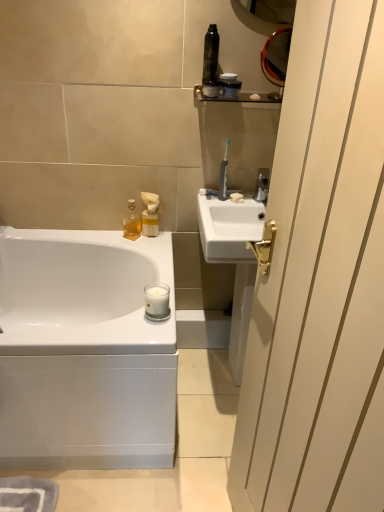
This screenshot has height=512, width=384. What are the coordinates of `white glossy bathtub at lower left` in the screenshot? It's located at (84, 351).

Find the location of `white glossy screen door at right`. white glossy screen door at right is located at coordinates (321, 280).

What's the angular difference between white glossy screen door at right and white glossy bathtub at lower left's facing directions?

They differ by 78.9 degrees in their facing directions.

Which object is further away from the camera, white glossy screen door at right or white glossy bathtub at lower left?

white glossy bathtub at lower left.

Is white glossy screen door at right surrounding white glossy bathtub at lower left?

No, white glossy bathtub at lower left is not surrounded by white glossy screen door at right.

In the scene shown: From a real-world perspective, is white glossy bathtub at lower left located beneath satin black container at upper center, which appears as the 2th toiletry when viewed from the front?

Yes, from a real-world perspective, white glossy bathtub at lower left is under satin black container at upper center, which appears as the 2th toiletry when viewed from the front.

Consider the image. Is white glossy bathtub at lower left in front of or behind satin black container at upper center, the 1th toiletry in the right-to-left sequence, in the image?

Visually, white glossy bathtub at lower left is located in front of satin black container at upper center, the 1th toiletry in the right-to-left sequence.

How distant is white glossy bathtub at lower left from satin black container at upper center, positioned as the 2th toiletry in back-to-front order?

white glossy bathtub at lower left is 1.05 meters away from satin black container at upper center, positioned as the 2th toiletry in back-to-front order.

From the image's perspective, which one is positioned higher, white glossy bathtub at lower left or satin black container at upper center, positioned as the second toiletry in bottom-to-top order?

satin black container at upper center, positioned as the second toiletry in bottom-to-top order, from the image's perspective.

Is white glossy screen door at right far from translucent glass bottle at upper left, positioned as the third toiletry in top-to-bottom order?

That's right, there is a large distance between white glossy screen door at right and translucent glass bottle at upper left, positioned as the third toiletry in top-to-bottom order.

From a real-world perspective, which is physically above, white glossy screen door at right or translucent glass bottle at upper left, marked as the 1th toiletry in a back-to-front arrangement?

white glossy screen door at right, from a real-world perspective.

The width and height of the screenshot is (384, 512). In order to click on screen door above the translucent glass bottle at upper left, which appears as the 1th toiletry when ordered from the bottom (from a real-world perspective) in this screenshot , I will do `click(321, 280)`.

Is white glossy screen door at right surrounding translucent glass bottle at upper left, which is the third toiletry from right to left?

No, white glossy screen door at right does not contain translucent glass bottle at upper left, which is the third toiletry from right to left.

Is the surface of translucent glass bottle at upper left, which is the third toiletry from right to left, in direct contact with shiny black canister at upper center, which is counted as the 2th toiletry, starting from the right?

translucent glass bottle at upper left, which is the third toiletry from right to left, and shiny black canister at upper center, which is counted as the 2th toiletry, starting from the right, are not in contact.

Which object is positioned more to the right, translucent glass bottle at upper left, arranged as the first toiletry when viewed from the left, or shiny black canister at upper center, the third toiletry from the back?

shiny black canister at upper center, the third toiletry from the back, is more to the right.

How much distance is there between translucent glass bottle at upper left, positioned as the third toiletry in top-to-bottom order, and shiny black canister at upper center, the third toiletry from the back?

translucent glass bottle at upper left, positioned as the third toiletry in top-to-bottom order, is 24.10 inches away from shiny black canister at upper center, the third toiletry from the back.

From a real-world perspective, who is located higher, translucent glass bottle at upper left, which appears as the 1th toiletry when ordered from the bottom, or shiny black canister at upper center, the third toiletry from the back?

shiny black canister at upper center, the third toiletry from the back, from a real-world perspective.

Which is more to the left, white glossy bathtub at lower left or white plastic toothbrush at upper right?

white glossy bathtub at lower left.

Does white glossy bathtub at lower left have a larger size compared to white plastic toothbrush at upper right?

Correct, white glossy bathtub at lower left is larger in size than white plastic toothbrush at upper right.

Which object is further away from the camera, white glossy bathtub at lower left or white plastic toothbrush at upper right?

white plastic toothbrush at upper right is further from the camera.

Can you confirm if white glossy bathtub at lower left is thinner than white plastic toothbrush at upper right?

No, white glossy bathtub at lower left is not thinner than white plastic toothbrush at upper right.

From the image's perspective, which one is positioned higher, shiny black canister at upper center, placed as the first toiletry when sorted from top to bottom, or white plastic toothbrush at upper right?

shiny black canister at upper center, placed as the first toiletry when sorted from top to bottom.

Which is behind, point (215, 28) or point (220, 197)?

Positioned behind is point (220, 197).

Does shiny black canister at upper center, positioned as the 1th toiletry in front-to-back order, have a larger size compared to white plastic toothbrush at upper right?

Correct, shiny black canister at upper center, positioned as the 1th toiletry in front-to-back order, is larger in size than white plastic toothbrush at upper right.

From a real-world perspective, who is located higher, shiny black canister at upper center, which is counted as the 2th toiletry, starting from the right, or white plastic toothbrush at upper right?

shiny black canister at upper center, which is counted as the 2th toiletry, starting from the right, from a real-world perspective.

Between satin black container at upper center, which is the third toiletry from left to right, and shiny black canister at upper center, which is counted as the third toiletry, starting from the bottom, which one appears on the left side from the viewer's perspective?

shiny black canister at upper center, which is counted as the third toiletry, starting from the bottom, is more to the left.

Considering the sizes of objects satin black container at upper center, which is the third toiletry from left to right, and shiny black canister at upper center, placed as the first toiletry when sorted from top to bottom, in the image provided, who is bigger, satin black container at upper center, which is the third toiletry from left to right, or shiny black canister at upper center, placed as the first toiletry when sorted from top to bottom,?

Bigger between the two is shiny black canister at upper center, placed as the first toiletry when sorted from top to bottom.

Locate an element on the screen. This screenshot has height=512, width=384. the 1st toiletry positioned below the shiny black canister at upper center, positioned as the 1th toiletry in front-to-back order (from the image's perspective) is located at coordinates (230, 85).

Is satin black container at upper center, which is the 2th toiletry in top-to-bottom order, thinner than shiny black canister at upper center, which is counted as the third toiletry, starting from the bottom?

Yes, satin black container at upper center, which is the 2th toiletry in top-to-bottom order, is thinner than shiny black canister at upper center, which is counted as the third toiletry, starting from the bottom.

Where is `bathtub on the left side of white glossy screen door at right`? The image size is (384, 512). bathtub on the left side of white glossy screen door at right is located at coordinates (84, 351).

Identify the location of toiletry that is the 2nd object located behind the white glossy bathtub at lower left. This screenshot has width=384, height=512. (230, 85).

Based on the photo, which object lies further to the anchor point white plastic toothbrush at upper right, shiny black canister at upper center, the third toiletry from the back, or white glossy screen door at right?

The object further to white plastic toothbrush at upper right is white glossy screen door at right.

Looking at the image, which one is located closer to shiny black canister at upper center, which is counted as the third toiletry, starting from the bottom, white glossy screen door at right or metallic silver shelf at upper center?

Among the two, metallic silver shelf at upper center is located nearer to shiny black canister at upper center, which is counted as the third toiletry, starting from the bottom.

Which object lies further to the anchor point shiny black canister at upper center, which is counted as the 2th toiletry, starting from the right, metallic silver shelf at upper center or white glossy bathtub at lower left?

white glossy bathtub at lower left is positioned further to the anchor shiny black canister at upper center, which is counted as the 2th toiletry, starting from the right.

When comparing their distances from white glossy bathtub at lower left, does white plastic toothbrush at upper right or white glossy screen door at right seem further?

white plastic toothbrush at upper right.

Considering their positions, is satin black container at upper center, which appears as the 2th toiletry when viewed from the front, positioned closer to white plastic toothbrush at upper right than white glossy screen door at right?

The object closer to white plastic toothbrush at upper right is satin black container at upper center, which appears as the 2th toiletry when viewed from the front.

Considering their positions, is satin black container at upper center, the 1th toiletry in the right-to-left sequence, positioned closer to white glossy screen door at right than translucent glass bottle at upper left, which is the third toiletry from right to left?

The object closer to white glossy screen door at right is satin black container at upper center, the 1th toiletry in the right-to-left sequence.

When comparing their distances from satin black container at upper center, positioned as the second toiletry in bottom-to-top order, does metallic silver shelf at upper center or white plastic toothbrush at upper right seem closer?

metallic silver shelf at upper center is closer to satin black container at upper center, positioned as the second toiletry in bottom-to-top order.

Estimate the real-world distances between objects in this image. Which object is further from shiny black canister at upper center, which is counted as the third toiletry, starting from the bottom, metallic silver shelf at upper center or white plastic toothbrush at upper right?

white plastic toothbrush at upper right is positioned further to the anchor shiny black canister at upper center, which is counted as the third toiletry, starting from the bottom.

Identify the location of balustrade between shiny black canister at upper center, which is counted as the 2th toiletry, starting from the right, and white plastic toothbrush at upper right, in the vertical direction. (236, 97).

Find the location of a particular element. This screenshot has width=384, height=512. toothbrush between translucent glass bottle at upper left, positioned as the third toiletry in top-to-bottom order, and metallic silver shelf at upper center, in the horizontal direction is located at coordinates (223, 175).

This screenshot has width=384, height=512. What are the coordinates of `toiletry between white glossy screen door at right and metallic silver shelf at upper center in the front-back direction` in the screenshot? It's located at (211, 63).

Find the location of a particular element. toiletry located between white glossy screen door at right and satin black container at upper center, which is the 2th toiletry in top-to-bottom order, in the depth direction is located at coordinates (211, 63).